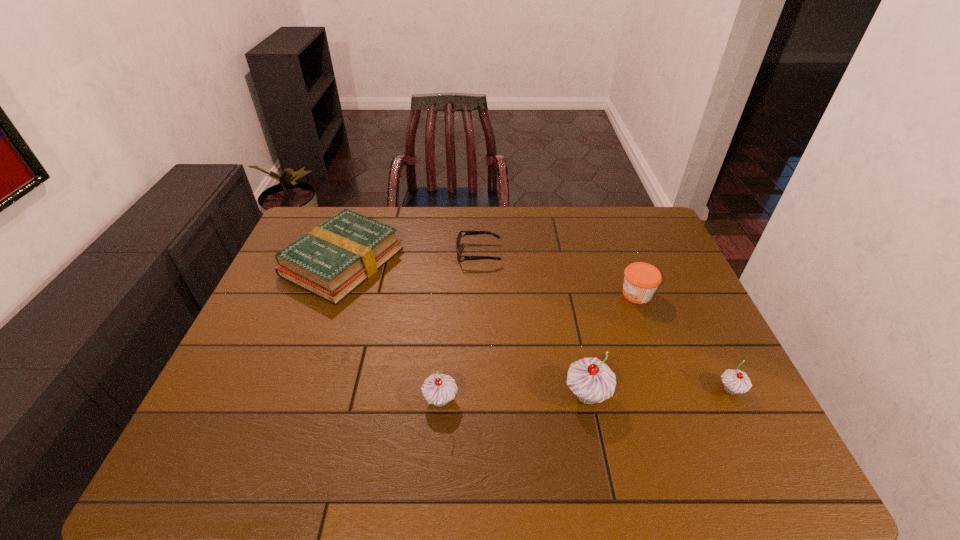
Image resolution: width=960 pixels, height=540 pixels. In order to click on free space located on the left of the second cupcake from left to right in this screenshot , I will do `click(479, 395)`.

Find the location of a particular element. This screenshot has height=540, width=960. vacant space positioned on the back of the rightmost cupcake is located at coordinates (682, 289).

Locate an element on the screen. This screenshot has width=960, height=540. vacant space situated 0.210m on the front-facing side of the shortest object is located at coordinates (564, 253).

Find the location of a particular element. This screenshot has width=960, height=540. free spot located 0.340m on the right of the hardback book is located at coordinates (507, 262).

This screenshot has height=540, width=960. Identify the location of vacant point located on the front label of the jam. (541, 294).

Locate an element on the screen. The height and width of the screenshot is (540, 960). vacant space located on the front label of the jam is located at coordinates (498, 294).

Where is `free location located 0.100m on the front label of the jam`? This screenshot has width=960, height=540. free location located 0.100m on the front label of the jam is located at coordinates pos(586,294).

The width and height of the screenshot is (960, 540). I want to click on sunglasses located in the far edge section of the desktop, so click(458, 239).

The height and width of the screenshot is (540, 960). I want to click on hardback book that is at the far edge, so click(x=332, y=260).

I want to click on object located at the left edge, so click(332, 260).